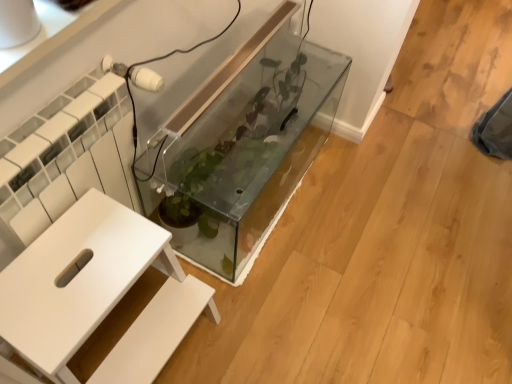
Question: Is transparent glass tank at center next to white matte table at center and touching it?

Choices:
 (A) yes
 (B) no

Answer: (B)

Question: Would you consider transparent glass tank at center to be distant from white matte table at center?

Choices:
 (A) yes
 (B) no

Answer: (B)

Question: From a real-world perspective, is transparent glass tank at center on white matte table at center?

Choices:
 (A) yes
 (B) no

Answer: (B)

Question: Does transparent glass tank at center lie in front of white matte table at center?

Choices:
 (A) yes
 (B) no

Answer: (B)

Question: Can you confirm if transparent glass tank at center is taller than white matte table at center?

Choices:
 (A) yes
 (B) no

Answer: (B)

Question: Considering the positions of white textured radiator at left and transparent glass tank at center in the image, is white textured radiator at left bigger or smaller than transparent glass tank at center?

Choices:
 (A) big
 (B) small

Answer: (B)

Question: Considering the positions of point (x=58, y=180) and point (x=303, y=77), is point (x=58, y=180) closer or farther from the camera than point (x=303, y=77)?

Choices:
 (A) closer
 (B) farther

Answer: (A)

Question: From the image's perspective, is white textured radiator at left located above or below transparent glass tank at center?

Choices:
 (A) above
 (B) below

Answer: (B)

Question: Considering their positions, is white textured radiator at left located in front of or behind transparent glass tank at center?

Choices:
 (A) behind
 (B) front

Answer: (B)

Question: From the image's perspective, is white matte table at center above or below transparent glass tank at center?

Choices:
 (A) below
 (B) above

Answer: (A)

Question: Would you say white matte table at center is inside or outside transparent glass tank at center?

Choices:
 (A) outside
 (B) inside

Answer: (A)

Question: In terms of width, does white matte table at center look wider or thinner when compared to transparent glass tank at center?

Choices:
 (A) thin
 (B) wide

Answer: (B)

Question: In the image, is white matte table at center positioned in front of or behind transparent glass tank at center?

Choices:
 (A) behind
 (B) front

Answer: (B)

Question: Considering the positions of white textured radiator at left and white matte table at center in the image, is white textured radiator at left bigger or smaller than white matte table at center?

Choices:
 (A) big
 (B) small

Answer: (B)

Question: Does point (86, 145) appear closer or farther from the camera than point (29, 251)?

Choices:
 (A) farther
 (B) closer

Answer: (A)